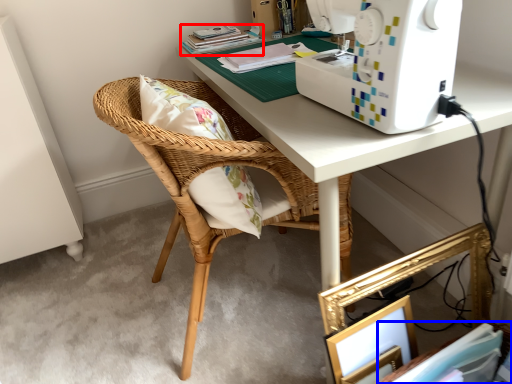
Question: Which point is further to the camera, book (highlighted by a red box) or book (highlighted by a blue box)?

Choices:
 (A) book
 (B) book

Answer: (A)